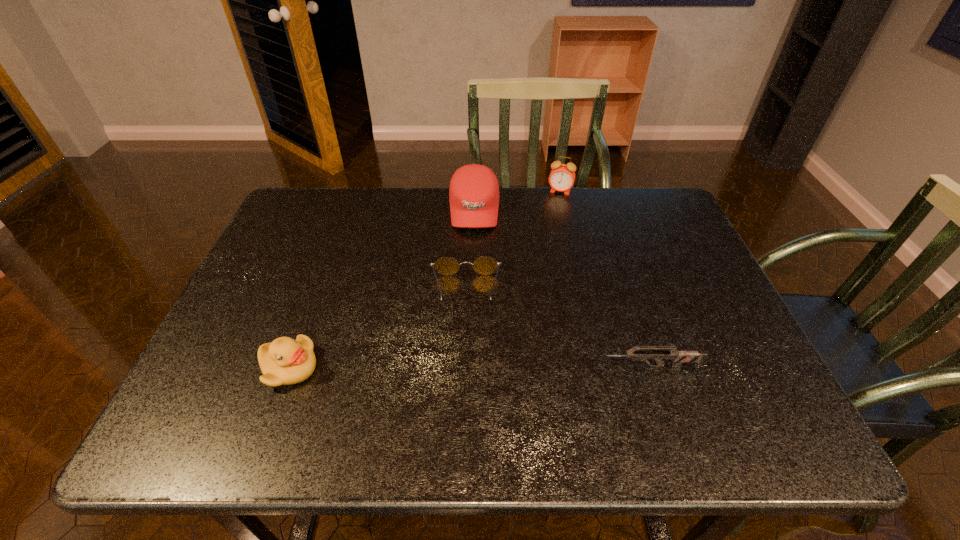
Find the location of `free region located 0.130m on the front-facing side of the third nearest object`. free region located 0.130m on the front-facing side of the third nearest object is located at coordinates (466, 355).

Where is `free spot located 0.180m on the front-facing side of the third nearest object`? This screenshot has width=960, height=540. free spot located 0.180m on the front-facing side of the third nearest object is located at coordinates (466, 375).

The height and width of the screenshot is (540, 960). Find the location of `vacant region located 0.220m on the front-facing side of the third nearest object`. vacant region located 0.220m on the front-facing side of the third nearest object is located at coordinates (466, 392).

This screenshot has width=960, height=540. I want to click on vacant region located on the front-facing side of the cap, so click(x=474, y=253).

At what (x,y) coordinates should I click in order to perform the action: click on free space located on the front-facing side of the cap. Please return your answer as a coordinate pair (x, y). Looking at the image, I should click on (473, 295).

You are a GUI agent. You are given a task and a screenshot of the screen. Output one action in this format:
    pyautogui.click(x=<x>, y=<y>)
    Task: Click on the free space located 0.360m on the front-facing side of the cap
    Image resolution: width=960 pixels, height=540 pixels.
    Given the screenshot: What is the action you would take?
    pyautogui.click(x=473, y=333)

Image resolution: width=960 pixels, height=540 pixels. Find the location of `free space located on the face of the alarm clock`. free space located on the face of the alarm clock is located at coordinates (539, 260).

You are a GUI agent. You are given a task and a screenshot of the screen. Output one action in this format:
    pyautogui.click(x=<x>, y=<y>)
    Task: Click on the vacant space located on the face of the alarm clock
    This screenshot has width=960, height=540.
    Given the screenshot: What is the action you would take?
    pyautogui.click(x=551, y=219)

You are a GUI agent. You are given a task and a screenshot of the screen. Output one action in this format:
    pyautogui.click(x=<x>, y=<y>)
    Task: Click on the free spot located on the face of the alarm clock
    Image resolution: width=960 pixels, height=540 pixels.
    Given the screenshot: What is the action you would take?
    pyautogui.click(x=535, y=275)

What are the coordinates of `cap located at the far edge` in the screenshot? It's located at (474, 191).